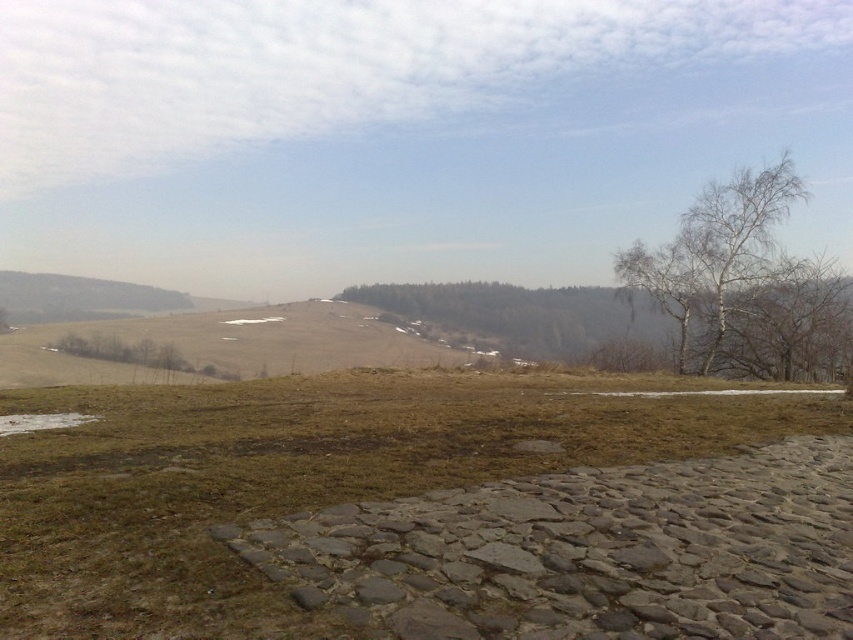
How far apart are brown grass at center and white bark tree at upper right?

They are 20.73 meters apart.

Does brown grass at center appear under white bark tree at upper right?

Indeed, brown grass at center is positioned under white bark tree at upper right.

What are the coordinates of `brown grass at center` in the screenshot? It's located at (328, 442).